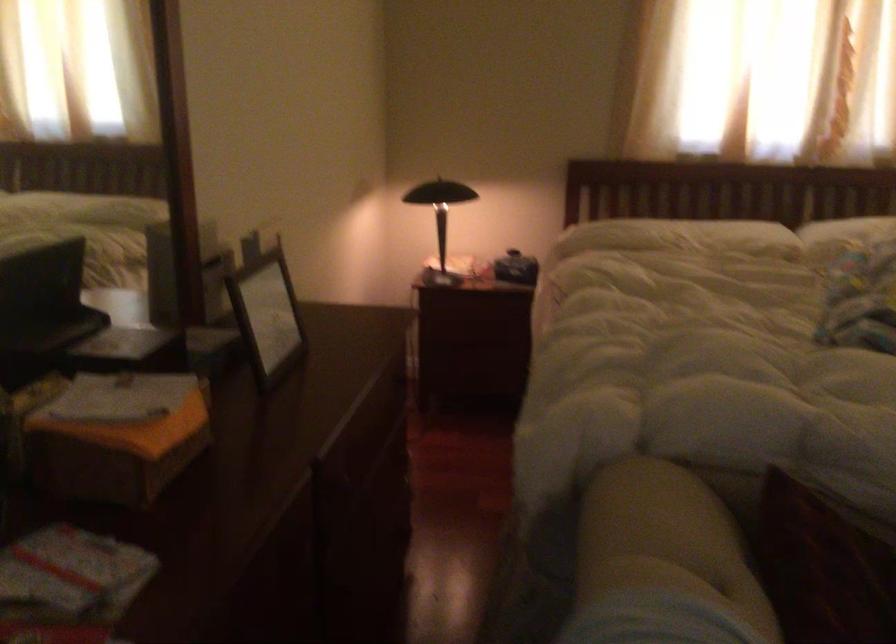
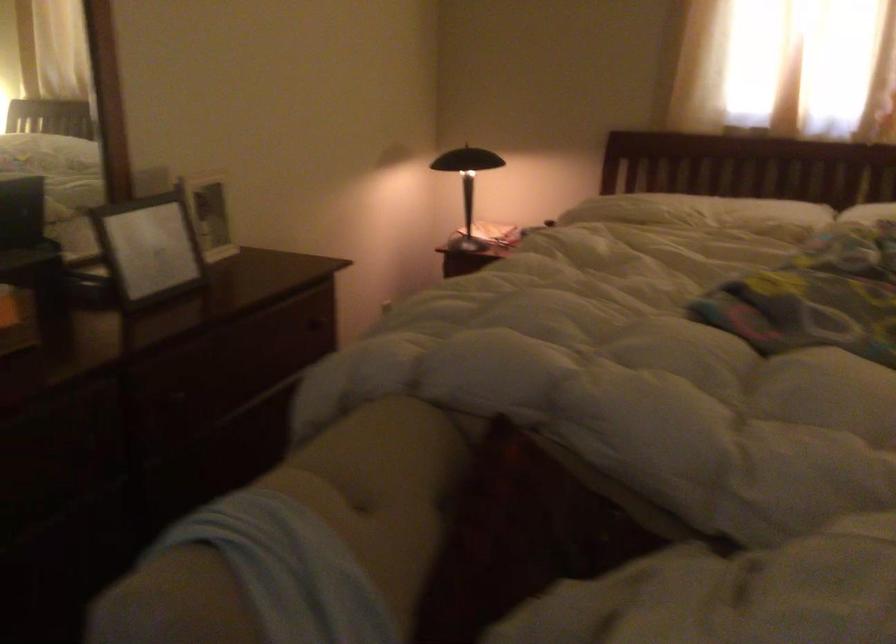
Question: The first image is from the beginning of the video and the second image is from the end. How did the camera likely rotate when shooting the video?

Choices:
 (A) Left
 (B) Right
 (C) Up
 (D) Down

Answer: (A)